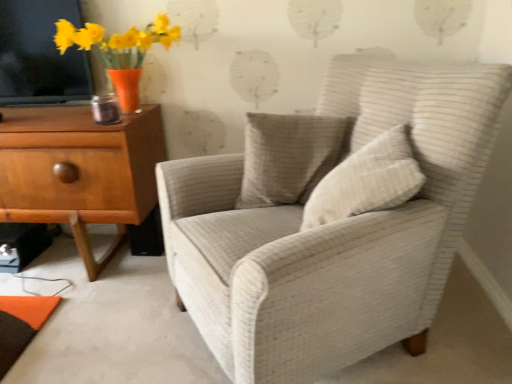
Question: Is point (67, 39) positioned closer to the camera than point (415, 185)?

Choices:
 (A) closer
 (B) farther

Answer: (B)

Question: Based on their sizes in the image, would you say matte orange vase with yellow flowers at upper left is bigger or smaller than beige textured pillow at center, which ranks as the 2th pillow in back-to-front order?

Choices:
 (A) small
 (B) big

Answer: (B)

Question: Estimate the real-world distances between objects in this image. Which object is closer to the light brown wood chest of drawers at left?

Choices:
 (A) textured beige pillow at center, which is the 1th pillow from back to front
 (B) white textured armchair at center
 (C) matte orange vase with yellow flowers at upper left
 (D) beige textured pillow at center, which ranks as the 2th pillow in back-to-front order

Answer: (C)

Question: Which of these objects is positioned closest to the matte orange vase with yellow flowers at upper left?

Choices:
 (A) textured beige pillow at center, which is the 1th pillow from back to front
 (B) white textured armchair at center
 (C) light brown wood chest of drawers at left
 (D) beige textured pillow at center, which appears as the first pillow when viewed from the front

Answer: (C)